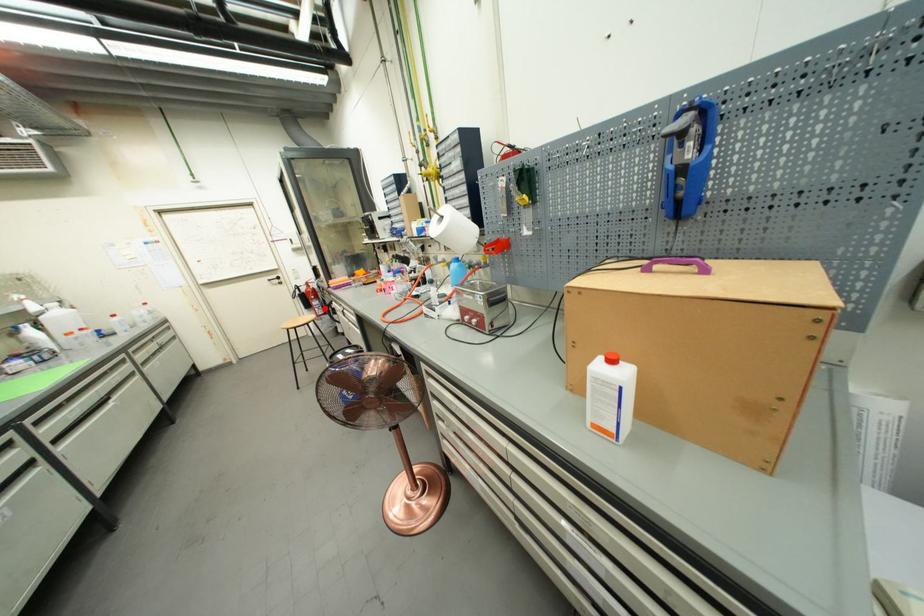
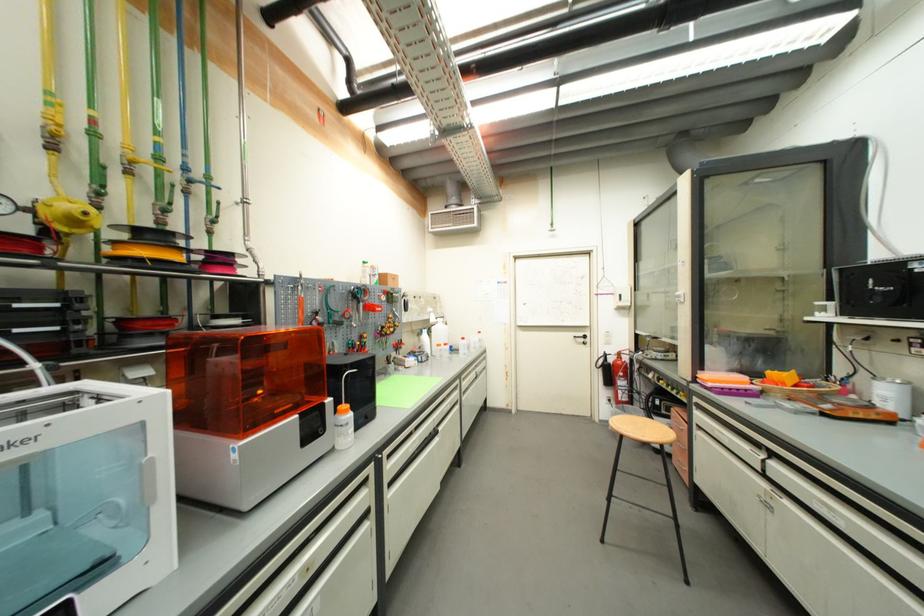
Question: I am providing you with two images of the same scene from different viewpoints. Given a red point in image1, look at the same physical point in image2. Is it:

Choices:
 (A) Closer to the viewpoint
 (B) Farther from the viewpoint

Answer: (A)